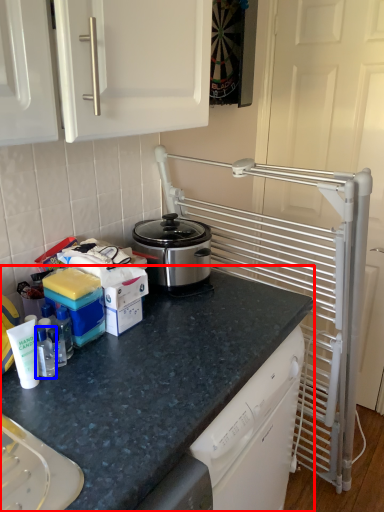
Question: Which object appears farthest to the camera in this image, countertop (highlighted by a red box) or bottle (highlighted by a blue box)?

Choices:
 (A) countertop
 (B) bottle

Answer: (B)